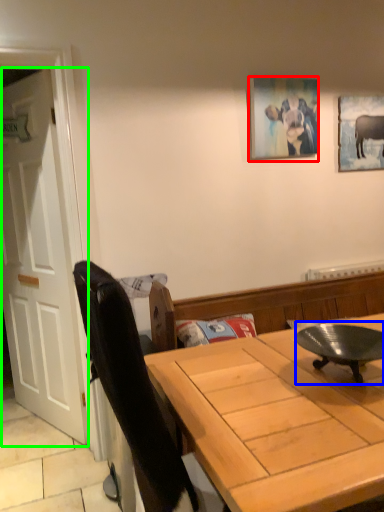
Question: Which object is positioned farthest from picture frame (highlighted by a red box)? Select from round table (highlighted by a blue box) and door (highlighted by a green box).

Choices:
 (A) round table
 (B) door

Answer: (B)